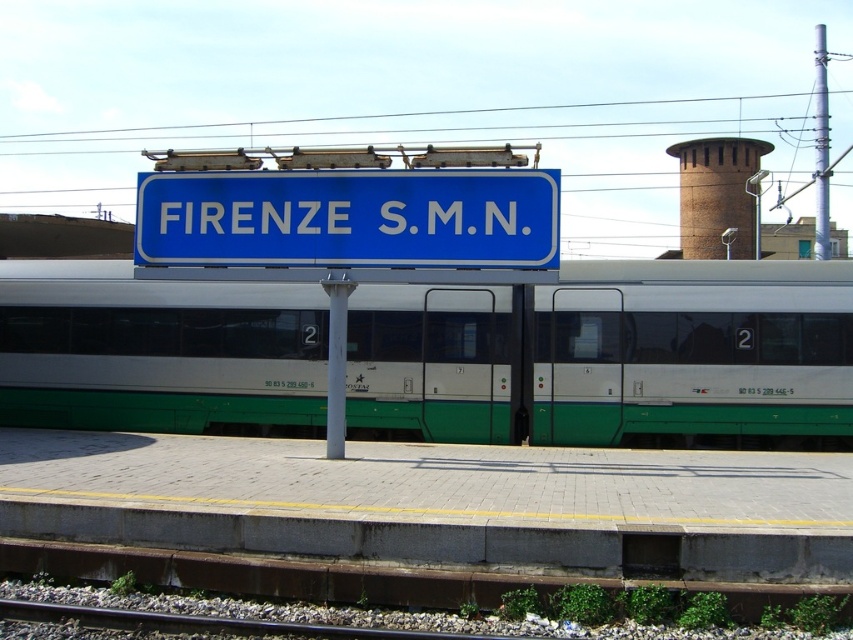
Does point (534, 362) come farther from viewer compared to point (341, 307)?

Yes.

Is point (86, 272) positioned after point (328, 413)?

That is True.

Where is `green metallic train at center`? Image resolution: width=853 pixels, height=640 pixels. green metallic train at center is located at coordinates (693, 352).

Is green metallic train at center below blue plastic sign at center?

Correct, green metallic train at center is located below blue plastic sign at center.

What do you see at coordinates (693, 352) in the screenshot? I see `green metallic train at center` at bounding box center [693, 352].

Where is `green metallic train at center`? The image size is (853, 640). green metallic train at center is located at coordinates (693, 352).

Is blue plastic sign at center to the right of white metallic pole at center from the viewer's perspective?

Correct, you'll find blue plastic sign at center to the right of white metallic pole at center.

Where is `blue plastic sign at center`? This screenshot has height=640, width=853. blue plastic sign at center is located at coordinates (349, 220).